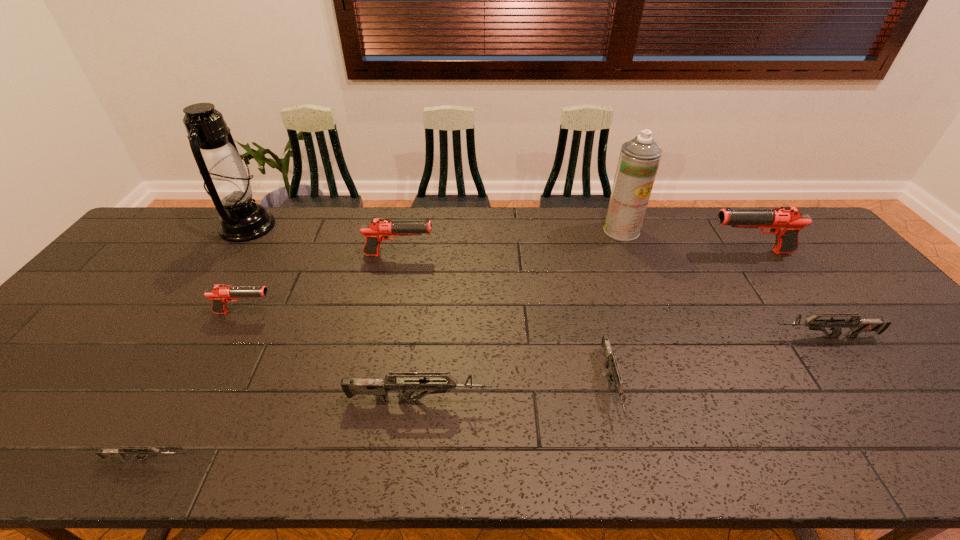
Identify the location of oil lamp. This screenshot has width=960, height=540. (228, 182).

Find the location of a particular element. The height and width of the screenshot is (540, 960). the third object from right to left is located at coordinates (639, 159).

This screenshot has width=960, height=540. I want to click on the eighth shortest object, so click(639, 159).

You are a GUI agent. You are given a task and a screenshot of the screen. Output one action in this format:
    pyautogui.click(x=<x>, y=<y>)
    Task: Click on the rightmost black gun
    This screenshot has width=960, height=540.
    Given the screenshot: What is the action you would take?
    pyautogui.click(x=785, y=222)

The image size is (960, 540). In order to click on the tallest gun in this screenshot , I will do `click(785, 222)`.

Image resolution: width=960 pixels, height=540 pixels. Find the location of `the second biggest black gun`. the second biggest black gun is located at coordinates (378, 229).

Image resolution: width=960 pixels, height=540 pixels. In order to click on the sixth shortest gun in this screenshot , I will do `click(378, 229)`.

Find the location of a particular element. This screenshot has width=960, height=540. the fifth nearest object is located at coordinates pos(220,294).

Identify the location of the leftmost black gun. Image resolution: width=960 pixels, height=540 pixels. (220, 294).

This screenshot has width=960, height=540. I want to click on the biggest grey gun, so click(x=379, y=387).